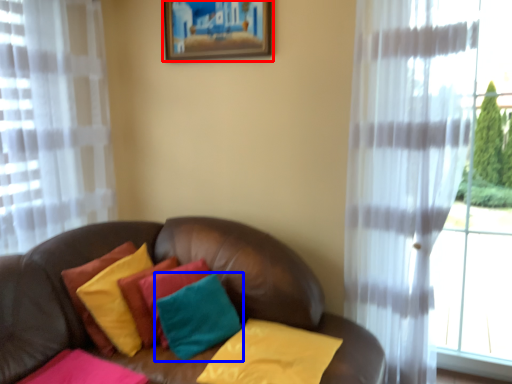
Question: Which point is closer to the camera, picture frame (highlighted by a red box) or pillow (highlighted by a blue box)?

Choices:
 (A) picture frame
 (B) pillow

Answer: (B)